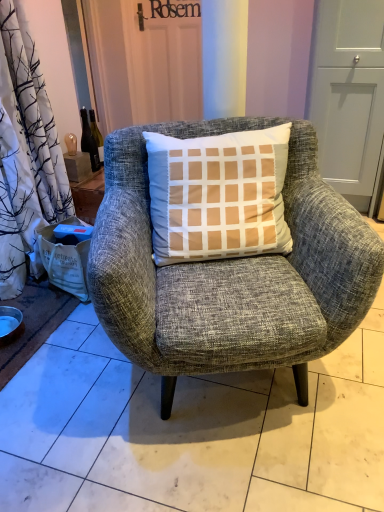
Question: Does textured gray armchair at center appear on the right side of translucent glass bottle at upper left?

Choices:
 (A) yes
 (B) no

Answer: (A)

Question: Does textured gray armchair at center come in front of translucent glass bottle at upper left?

Choices:
 (A) yes
 (B) no

Answer: (A)

Question: Is textured gray armchair at center behind translucent glass bottle at upper left?

Choices:
 (A) no
 (B) yes

Answer: (A)

Question: From the image's perspective, is textured gray armchair at center located beneath translucent glass bottle at upper left?

Choices:
 (A) no
 (B) yes

Answer: (B)

Question: Is textured gray armchair at center to the left of translucent glass bottle at upper left from the viewer's perspective?

Choices:
 (A) no
 (B) yes

Answer: (A)

Question: From a real-world perspective, does textured gray armchair at center sit lower than translucent glass bottle at upper left?

Choices:
 (A) yes
 (B) no

Answer: (A)

Question: Is white paper bag at lower left thinner than matte silver bowl at lower left?

Choices:
 (A) no
 (B) yes

Answer: (A)

Question: Can matte silver bowl at lower left be found inside white paper bag at lower left?

Choices:
 (A) yes
 (B) no

Answer: (B)

Question: From the image's perspective, is white paper bag at lower left below matte silver bowl at lower left?

Choices:
 (A) yes
 (B) no

Answer: (B)

Question: Is white paper bag at lower left beside matte silver bowl at lower left?

Choices:
 (A) no
 (B) yes

Answer: (A)

Question: Does white paper bag at lower left lie in front of matte silver bowl at lower left?

Choices:
 (A) yes
 (B) no

Answer: (B)

Question: From a real-world perspective, does white paper bag at lower left stand above matte silver bowl at lower left?

Choices:
 (A) no
 (B) yes

Answer: (B)

Question: Does matte gray screen door at upper right have a greater height compared to matte silver bowl at lower left?

Choices:
 (A) yes
 (B) no

Answer: (A)